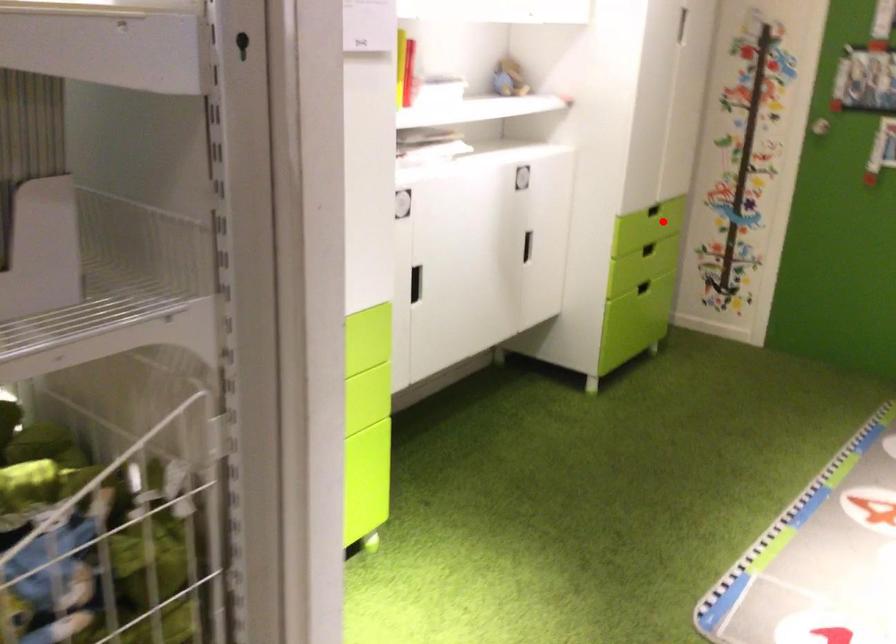
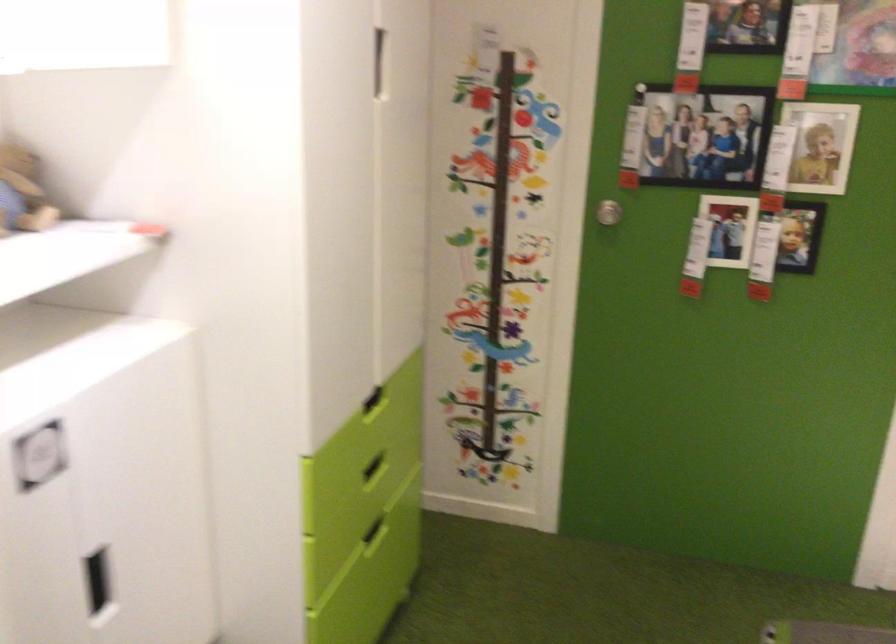
Where in the second image is the point corresponding to the highlighted location from the first image?

(373, 401)